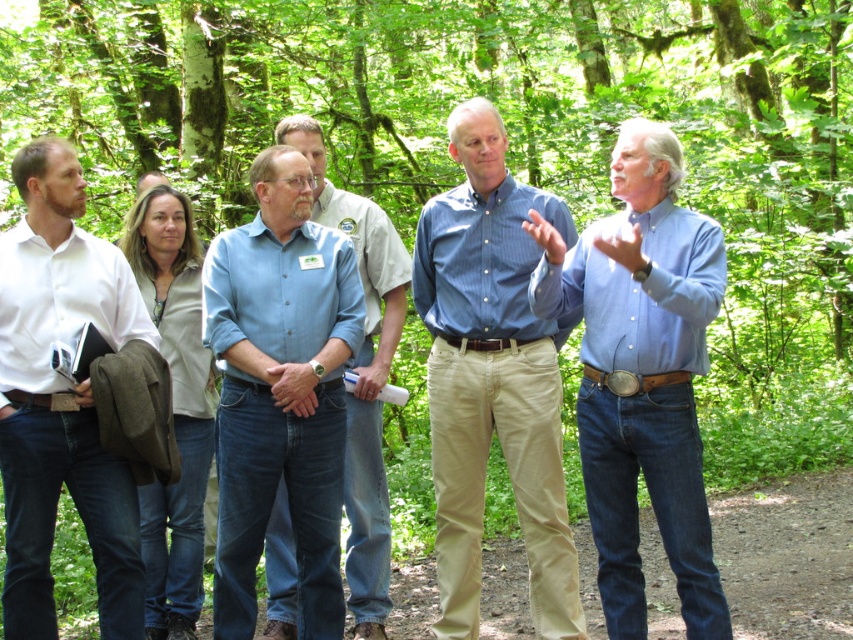
You are a photographer standing in the forest and want to take a photo of the blue denim shirt at center and the blue cotton shirt at center. If your camera can capture a maximum distance of 1.5 meters between subjects, will both shirts be in the same frame?

The blue denim shirt at center and blue cotton shirt at center are 1.43 meters apart, so yes, both shirts can be captured in the same frame since the distance is within the camera maximum of 1.5 meters.

You are organizing a clothing swap event and need to categorize shirts by size. You see two shirts at the center of the image, a blue denim shirt at center and a blue cotton shirt at center. Which shirt should you place in the larger size section?

The blue denim shirt at center should be placed in the larger size section because its width is larger than the blue cotton shirt at center.